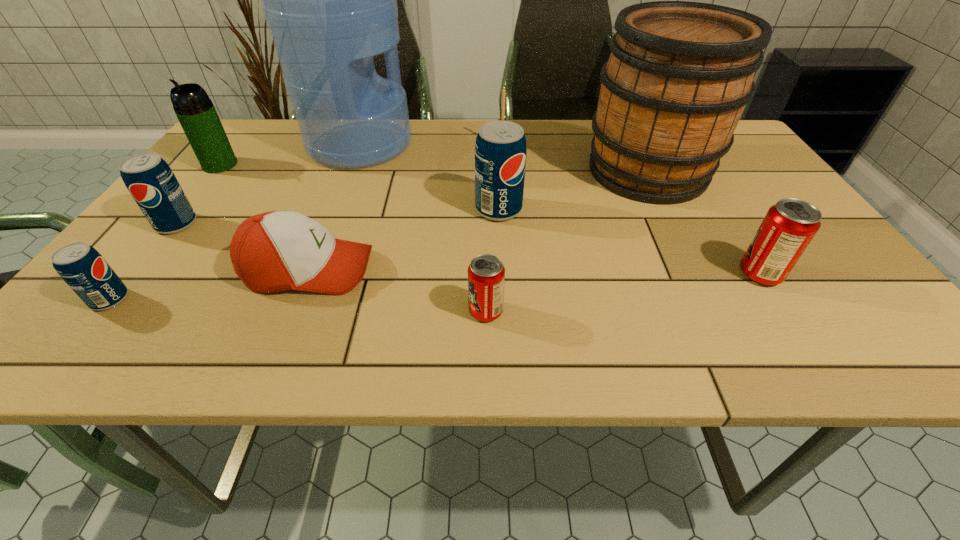
You are a GUI agent. You are given a task and a screenshot of the screen. Output one action in this format:
    pyautogui.click(x=<x>, y=<y>)
    Task: Click on the free space between the smallest blue pop and the blue water jug
    The image size is (960, 540).
    Given the screenshot: What is the action you would take?
    pyautogui.click(x=235, y=222)

The width and height of the screenshot is (960, 540). Find the location of `vacant area that lies between the bigger red soda can and the candle_holder`. vacant area that lies between the bigger red soda can and the candle_holder is located at coordinates (631, 211).

In order to click on free space between the second tallest object and the candle_holder in this screenshot , I will do `click(575, 159)`.

Locate an element on the screen. This screenshot has height=540, width=960. empty space that is in between the candle_holder and the smaller red soda can is located at coordinates (493, 229).

This screenshot has width=960, height=540. Find the location of `empty space between the nearest blue pop and the bigger red soda can`. empty space between the nearest blue pop and the bigger red soda can is located at coordinates (435, 287).

You are a GUI agent. You are given a task and a screenshot of the screen. Output one action in this format:
    pyautogui.click(x=<x>, y=<y>)
    Task: Click on the vacant region between the tallest object and the smaller red soda can
    This screenshot has width=960, height=540.
    Given the screenshot: What is the action you would take?
    pyautogui.click(x=422, y=228)

At what (x,y) coordinates should I click in order to perform the action: click on vacant area between the rightmost soda can and the candle_holder. Please return your answer as a coordinate pair (x, y). The image size is (960, 540). Looking at the image, I should click on (631, 211).

Find the location of `free point between the left red soda can and the tallest object`. free point between the left red soda can and the tallest object is located at coordinates (422, 228).

The image size is (960, 540). I want to click on the second closest object to the farther red soda can, so click(500, 151).

Where is `object that is the seventh closest to the tallest object`? The width and height of the screenshot is (960, 540). object that is the seventh closest to the tallest object is located at coordinates (680, 73).